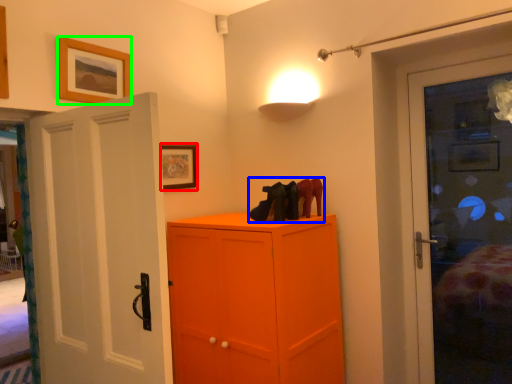
Question: Estimate the real-world distances between objects in this image. Which object is closer to picture frame (highlighted by a red box), footwear (highlighted by a blue box) or picture frame (highlighted by a green box)?

Choices:
 (A) footwear
 (B) picture frame

Answer: (B)